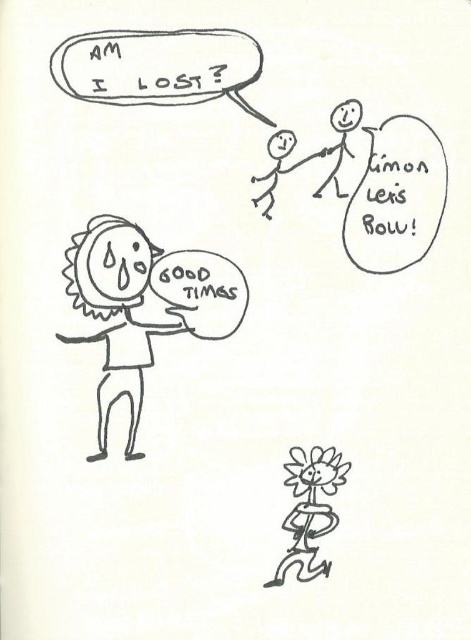
Which of these two, sun-shaped face at left or black line drawing stick figure at upper center, stands taller?

sun-shaped face at left is taller.

How far apart are sun-shaped face at left and black line drawing stick figure at upper center?

sun-shaped face at left and black line drawing stick figure at upper center are 7.44 inches apart from each other.

Is point (99, 225) in front of point (274, 182)?

Yes, it is.

This screenshot has width=471, height=640. I want to click on sun-shaped face at left, so click(x=116, y=312).

Is sun-shaped face at left shorter than flower-patterned stick figure at lower right?

No.

Is point (115, 285) behind point (330, 492)?

No, (115, 285) is in front of (330, 492).

This screenshot has height=640, width=471. What do you see at coordinates (116, 312) in the screenshot?
I see `sun-shaped face at left` at bounding box center [116, 312].

This screenshot has height=640, width=471. Identify the location of sun-shaped face at left. (116, 312).

Is flower-patterned stick figure at lower right shorter than black line drawing stick figure at upper center?

No.

Describe the element at coordinates (309, 509) in the screenshot. This screenshot has width=471, height=640. I see `flower-patterned stick figure at lower right` at that location.

The height and width of the screenshot is (640, 471). Describe the element at coordinates (309, 509) in the screenshot. I see `flower-patterned stick figure at lower right` at that location.

Find the location of a particular element. flower-patterned stick figure at lower right is located at coordinates (309, 509).